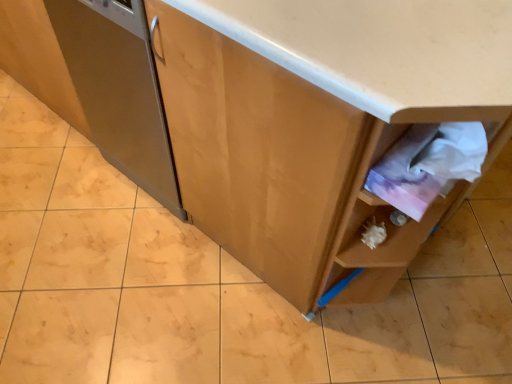
Image resolution: width=512 pixels, height=384 pixels. I want to click on free region on the left part of matte wood cabinet at left, so click(69, 174).